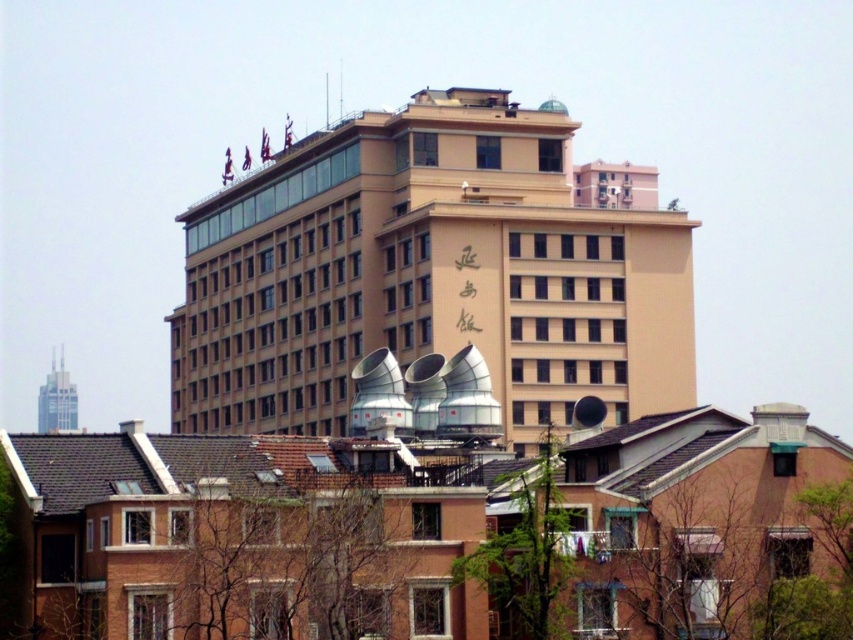
Question: Is beige concrete building at center closer to camera compared to glassy steel skyscraper at upper left?

Choices:
 (A) yes
 (B) no

Answer: (A)

Question: Can you confirm if beige concrete building at center is wider than glassy steel skyscraper at upper left?

Choices:
 (A) yes
 (B) no

Answer: (A)

Question: Is beige concrete building at center to the right of glassy steel skyscraper at upper left from the viewer's perspective?

Choices:
 (A) no
 (B) yes

Answer: (B)

Question: Which point is closer to the camera?

Choices:
 (A) (51, 416)
 (B) (438, 266)

Answer: (B)

Question: Which of the following is the closest to the observer?

Choices:
 (A) beige concrete building at center
 (B) glassy steel skyscraper at upper left

Answer: (A)